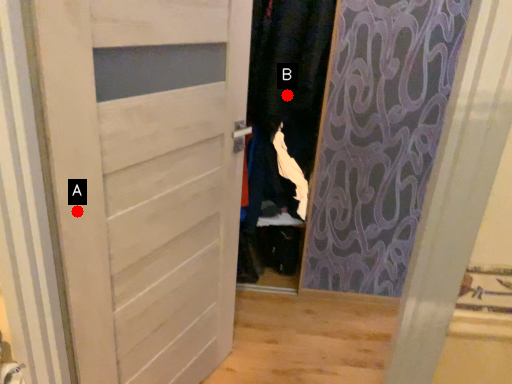
Question: Two points are circled on the image, labeled by A and B beside each circle. Among these points, which one is farthest from the camera?

Choices:
 (A) A is further
 (B) B is further

Answer: (B)